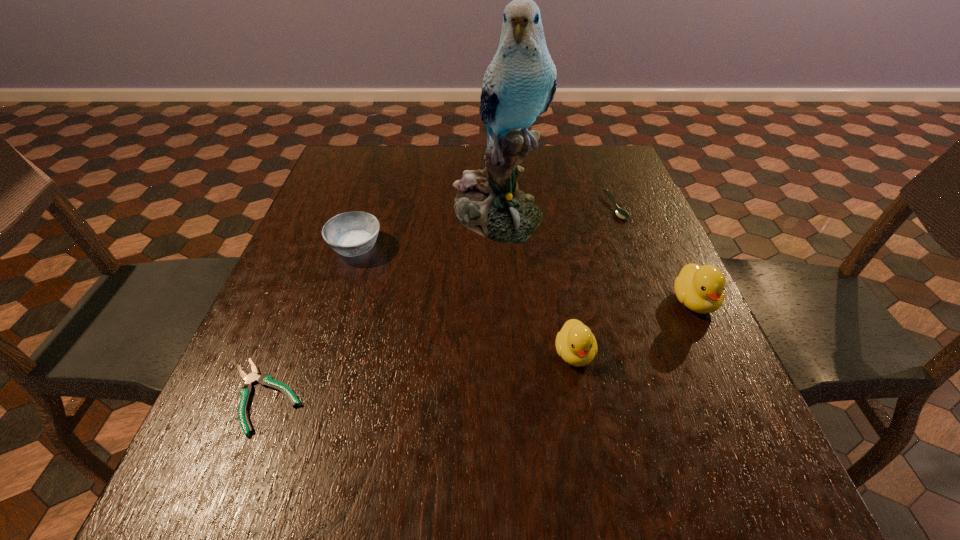
Find the location of a particular element. the nearer duckling is located at coordinates click(x=575, y=343).

Identify the location of the shorter duckling. This screenshot has width=960, height=540. pos(575,343).

The width and height of the screenshot is (960, 540). I want to click on the second tallest object, so click(700, 288).

Find the location of a particular element. the rightmost object is located at coordinates (700, 288).

The height and width of the screenshot is (540, 960). I want to click on the tallest object, so click(519, 85).

Where is `ashtray`? This screenshot has height=540, width=960. ashtray is located at coordinates pos(354,233).

I want to click on the fifth object from left to right, so click(619, 212).

Locate an element on the screen. The image size is (960, 540). soupspoon is located at coordinates (619, 212).

Locate an element on the screen. the shortest object is located at coordinates (246, 390).

Locate an element on the screen. The width and height of the screenshot is (960, 540). free space located 0.110m on the beak of the shorter duckling is located at coordinates (589, 433).